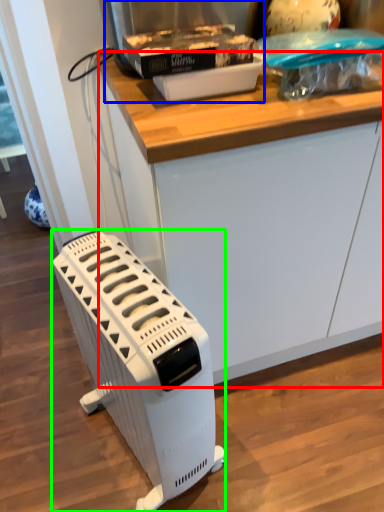
Question: Which is farther away from counter (highlighted by a red box)? appliance (highlighted by a blue box) or home appliance (highlighted by a green box)?

Choices:
 (A) appliance
 (B) home appliance

Answer: (B)